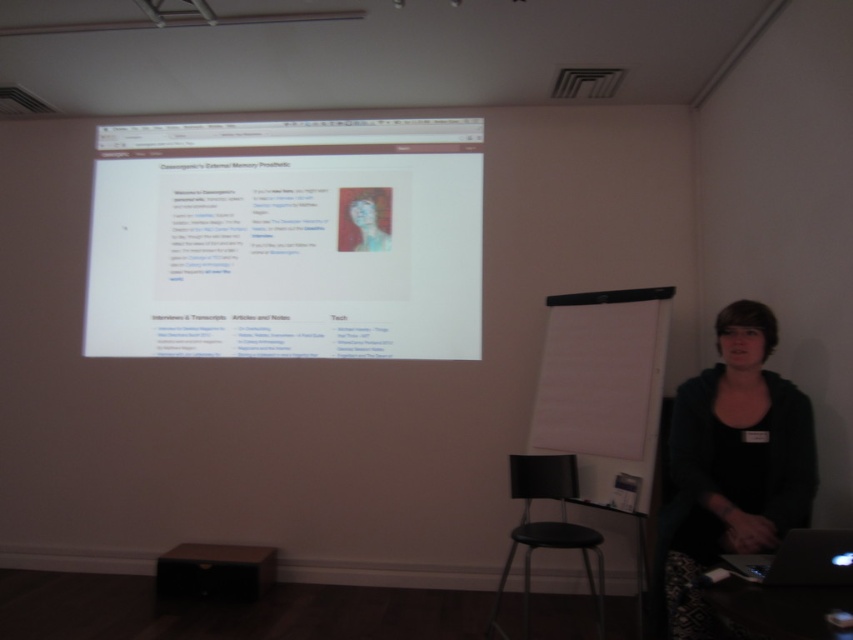
Which is below, black fabric at lower right or black glossy laptop at lower right?

black glossy laptop at lower right

Between point (732, 472) and point (840, 580), which one is positioned in front?

Positioned in front is point (840, 580).

This screenshot has width=853, height=640. I want to click on black fabric at lower right, so click(732, 465).

Measure the distance between black fabric at lower right and camera.

black fabric at lower right is 2.06 meters away from camera.

Does black fabric at lower right have a larger size compared to brown matte stool at lower center?

Correct, black fabric at lower right is larger in size than brown matte stool at lower center.

Is point (770, 412) less distant than point (161, 593)?

Yes, it is in front of point (161, 593).

I want to click on black fabric at lower right, so click(x=732, y=465).

Does point (126, 262) lie in front of point (567, 524)?

No, it is behind (567, 524).

The width and height of the screenshot is (853, 640). Identify the location of white matte projector screen at upper center. (286, 240).

Is point (288, 298) less distant than point (498, 592)?

No.

What are the coordinates of `white matte projector screen at upper center` in the screenshot? It's located at (286, 240).